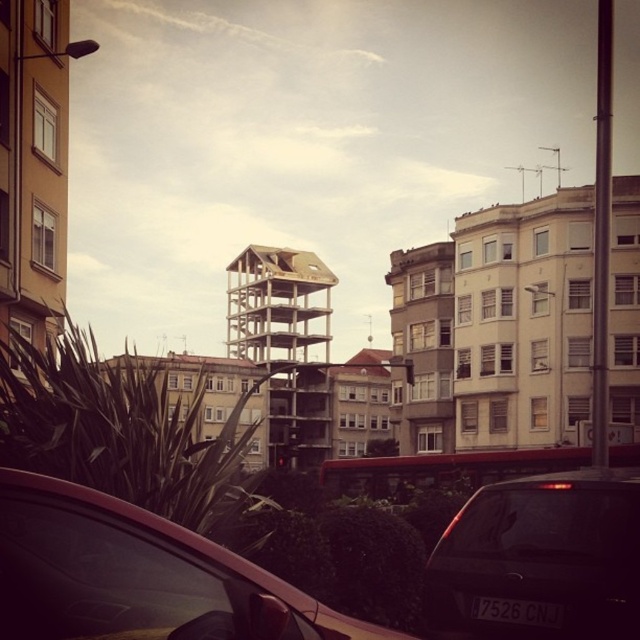
Who is shorter, white matte building at center or wooden scaffolding at center?

Standing shorter between the two is white matte building at center.

Is white matte building at center below wooden scaffolding at center?

Incorrect, white matte building at center is not positioned below wooden scaffolding at center.

Between point (540, 385) and point (234, 259), which one is positioned in front?

Positioned in front is point (540, 385).

You are a GUI agent. You are given a task and a screenshot of the screen. Output one action in this format:
    pyautogui.click(x=<x>, y=<y>)
    Task: Click on the white matte building at center
    
    Given the screenshot: What is the action you would take?
    pyautogui.click(x=524, y=321)

Based on the photo, who is positioned more to the right, white matte building at center or matte red car at lower left?

Positioned to the right is white matte building at center.

Does white matte building at center have a lesser width compared to matte red car at lower left?

No, white matte building at center is not thinner than matte red car at lower left.

Who is more forward, (566, 195) or (28, 545)?

Point (28, 545) is in front.

The height and width of the screenshot is (640, 640). Identify the location of white matte building at center. (524, 321).

Does white matte building at center lie behind black matte car at lower right?

Yes, white matte building at center is further from the viewer.

Does white matte building at center have a greater height compared to black matte car at lower right?

Yes, white matte building at center is taller than black matte car at lower right.

Which is behind, point (540, 349) or point (595, 484)?

Positioned behind is point (540, 349).

You are a GUI agent. You are given a task and a screenshot of the screen. Output one action in this format:
    pyautogui.click(x=<x>, y=<y>)
    Task: Click on the white matte building at center
    This screenshot has height=640, width=640.
    Given the screenshot: What is the action you would take?
    pyautogui.click(x=524, y=321)